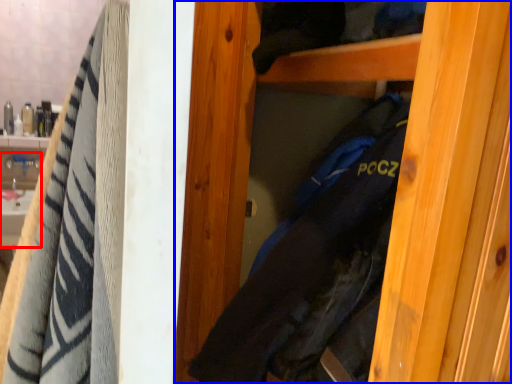
Question: Which of the following is the farthest to the observer, sink (highlighted by a red box) or door (highlighted by a blue box)?

Choices:
 (A) sink
 (B) door

Answer: (A)